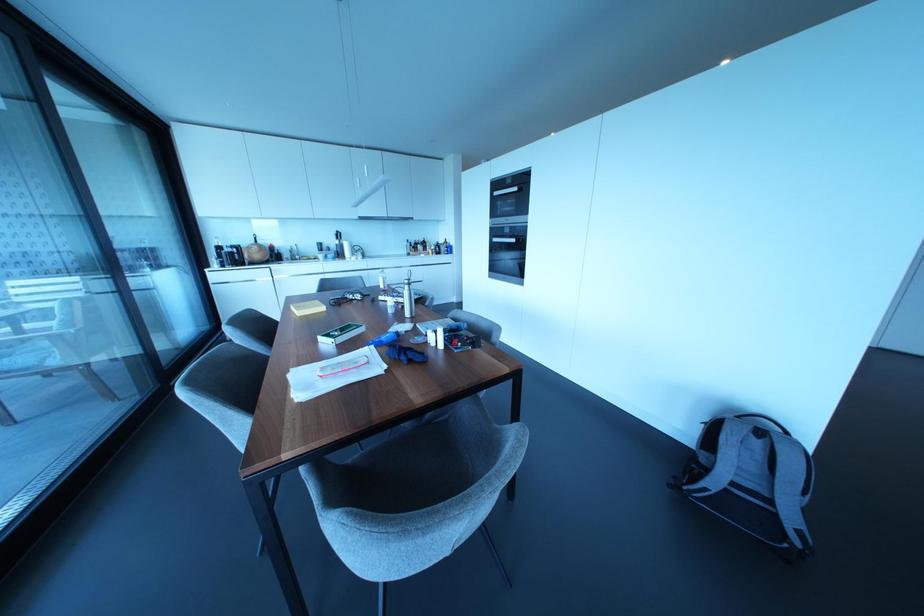
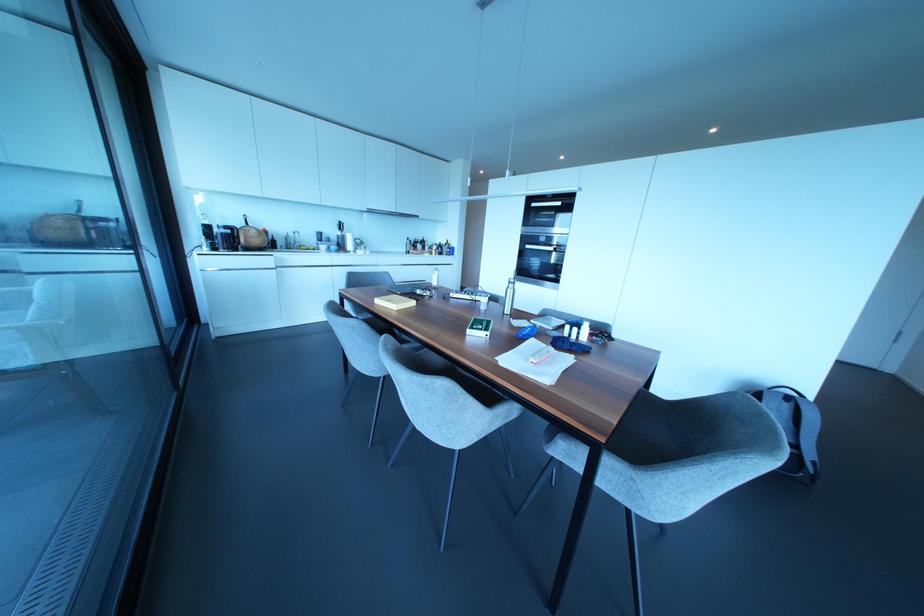
Find the pixel in the second image that matches the point at 517,240 in the first image.

(553, 248)